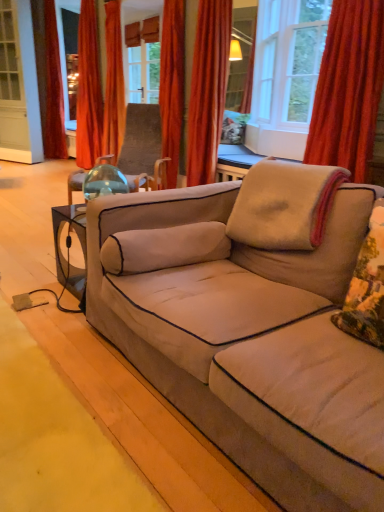
Question: Does velvet red curtain at left, which is counted as the fifth curtain, starting from the right, contain beige fabric couch at center?

Choices:
 (A) yes
 (B) no

Answer: (B)

Question: From the image's perspective, is velvet red curtain at left, which is counted as the fifth curtain, starting from the right, located beneath beige fabric couch at center?

Choices:
 (A) no
 (B) yes

Answer: (A)

Question: Does velvet red curtain at left, the fifth curtain positioned from the front, appear on the right side of beige fabric couch at center?

Choices:
 (A) yes
 (B) no

Answer: (B)

Question: Can you confirm if velvet red curtain at left, which ranks as the 1th curtain in left-to-right order, is smaller than beige fabric couch at center?

Choices:
 (A) yes
 (B) no

Answer: (A)

Question: Is velvet red curtain at left, the fifth curtain positioned from the front, closer to the viewer compared to beige fabric couch at center?

Choices:
 (A) no
 (B) yes

Answer: (A)

Question: Is fluffy beige pillow at right, which is the first pillow in front-to-back order, situated inside velvet red curtain at left, which is counted as the fifth curtain, starting from the right, or outside?

Choices:
 (A) inside
 (B) outside

Answer: (B)

Question: Is fluffy beige pillow at right, which is the first pillow in front-to-back order, in front of or behind velvet red curtain at left, the fifth curtain positioned from the front, in the image?

Choices:
 (A) front
 (B) behind

Answer: (A)

Question: Considering the positions of point (374, 333) and point (44, 83), is point (374, 333) closer or farther from the camera than point (44, 83)?

Choices:
 (A) farther
 (B) closer

Answer: (B)

Question: From the image's perspective, relative to velvet red curtain at left, placed as the first curtain when sorted from back to front, is fluffy beige pillow at right, which is the first pillow in front-to-back order, above or below?

Choices:
 (A) below
 (B) above

Answer: (A)

Question: From a real-world perspective, is beige fabric couch at center positioned above or below velvet orange curtain at upper center, arranged as the 2th curtain when viewed from the front?

Choices:
 (A) above
 (B) below

Answer: (B)

Question: Based on their sizes in the image, would you say beige fabric couch at center is bigger or smaller than velvet orange curtain at upper center, arranged as the 2th curtain when viewed from the front?

Choices:
 (A) small
 (B) big

Answer: (B)

Question: Looking at their shapes, would you say beige fabric couch at center is wider or thinner than velvet orange curtain at upper center, the 2th curtain when ordered from right to left?

Choices:
 (A) thin
 (B) wide

Answer: (B)

Question: Is beige fabric couch at center inside the boundaries of velvet orange curtain at upper center, the 2th curtain when ordered from right to left, or outside?

Choices:
 (A) inside
 (B) outside

Answer: (B)

Question: Based on their sizes in the image, would you say orange velvet curtain at upper left, the 4th curtain viewed from the right, is bigger or smaller than wooden paneling at upper center?

Choices:
 (A) big
 (B) small

Answer: (A)

Question: From their relative heights in the image, would you say orange velvet curtain at upper left, arranged as the 4th curtain when viewed from the front, is taller or shorter than wooden paneling at upper center?

Choices:
 (A) tall
 (B) short

Answer: (A)